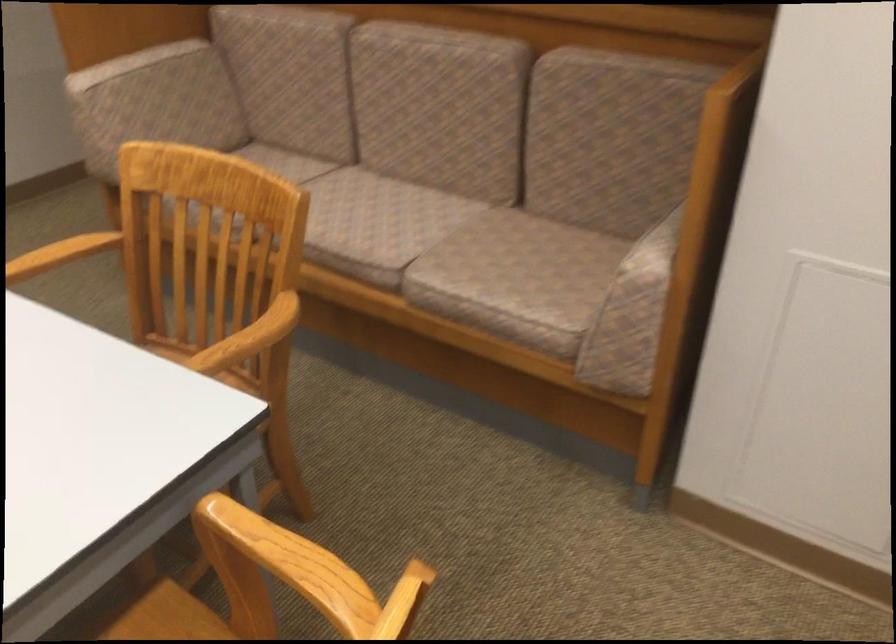
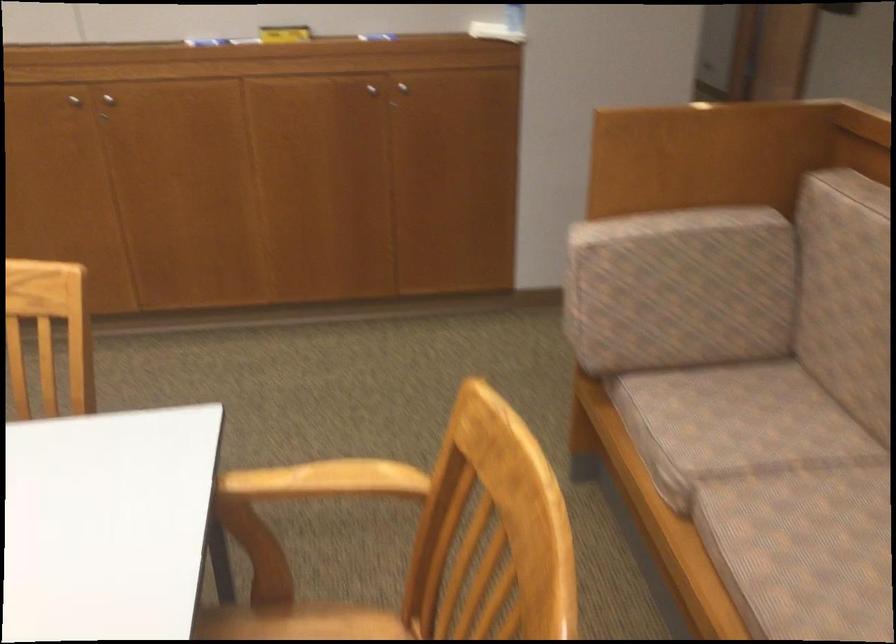
Question: The images are taken continuously from a first-person perspective. In which direction is your viewpoint rotating?

Choices:
 (A) Left
 (B) Right
 (C) Up
 (D) Down

Answer: (A)